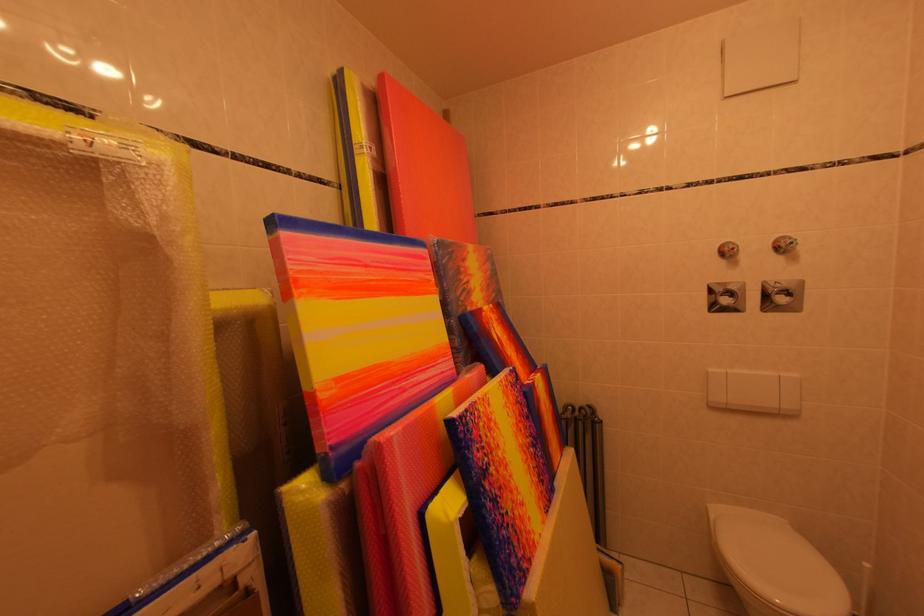
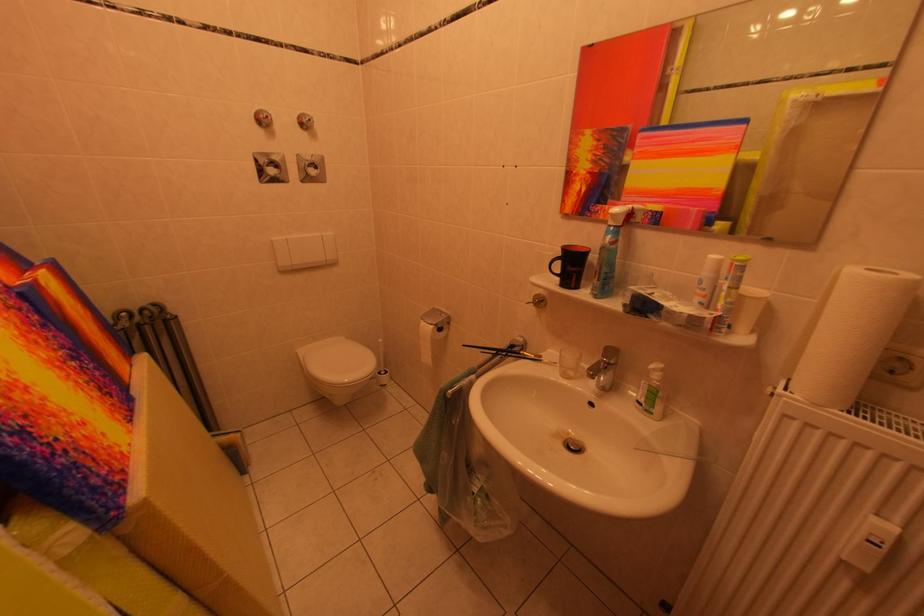
Locate, in the second image, the point that corresponds to (734,305) in the first image.

(282, 175)